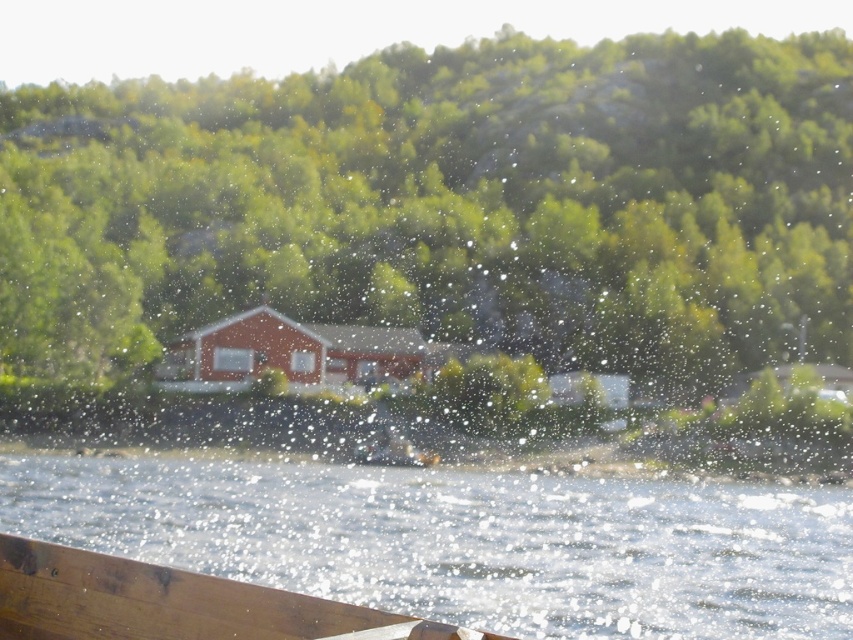
You are standing at the edge of the lakeside and want to locate the clear water. According to the coordinates provided, where exactly would you find the clear water at lower center?

The clear water at lower center is located at coordinates point [468,541].